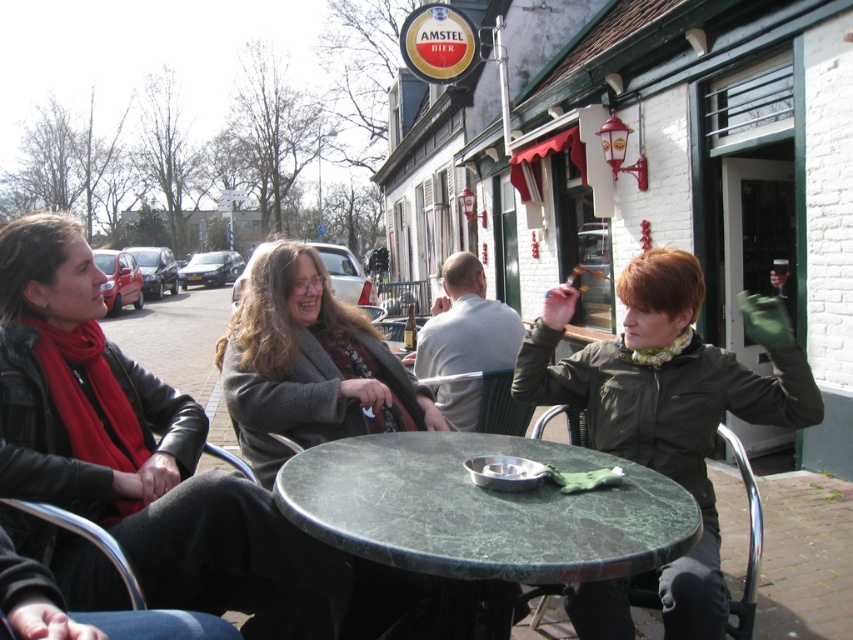
Who is more distant from viewer, (445, 522) or (267, 352)?

The point (267, 352) is behind.

Can you confirm if green marble table at center is wider than gray woolen sweater at center?

Yes, green marble table at center is wider than gray woolen sweater at center.

Between point (595, 554) and point (270, 296), which one is positioned behind?

Point (270, 296)

Where is `green marble table at center`? The width and height of the screenshot is (853, 640). green marble table at center is located at coordinates (482, 509).

Can you confirm if leather jacket at left is thinner than green marble table at center?

In fact, leather jacket at left might be wider than green marble table at center.

Between leather jacket at left and green marble table at center, which one appears on the right side from the viewer's perspective?

green marble table at center

Does point (57, 221) come closer to viewer compared to point (334, 467)?

No, (57, 221) is behind (334, 467).

The width and height of the screenshot is (853, 640). I want to click on leather jacket at left, so click(x=137, y=451).

Which is more to the left, leather jacket at left or gray woolen sweater at center?

Positioned to the left is leather jacket at left.

Is point (77, 266) farther from camera compared to point (257, 312)?

That is False.

At what (x,y) coordinates should I click in order to perform the action: click on leather jacket at left. Please return your answer as a coordinate pair (x, y). Looking at the image, I should click on (137, 451).

Where is `leather jacket at left`? The height and width of the screenshot is (640, 853). leather jacket at left is located at coordinates (137, 451).